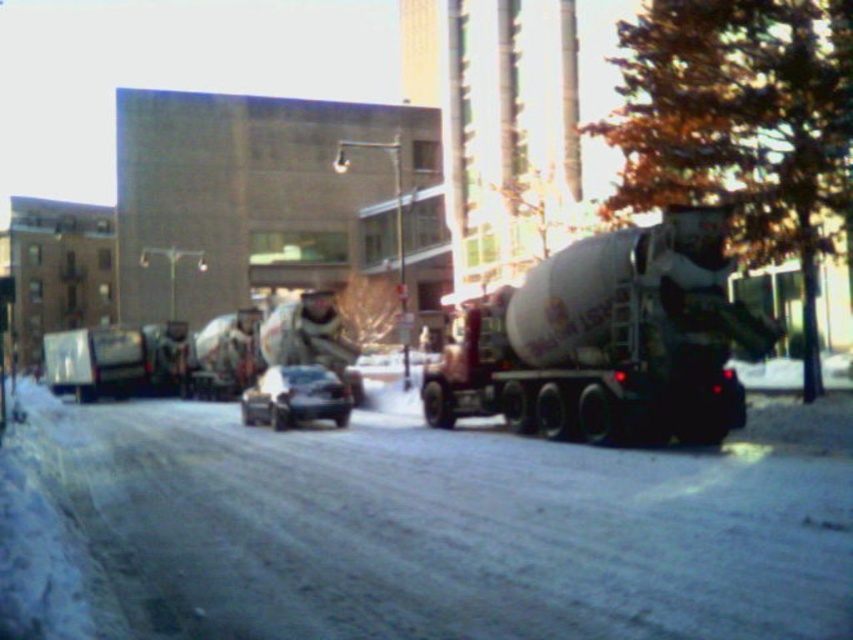
Is white matte cement truck at right to the left of shiny black sedan at center from the viewer's perspective?

No, white matte cement truck at right is not to the left of shiny black sedan at center.

Between point (637, 280) and point (250, 420), which one is positioned behind?

The point (250, 420) is more distant.

Who is more distant from viewer, (664,403) or (346,392)?

The point (346,392) is behind.

Identify the location of white matte cement truck at right. (607, 340).

Is point (202, 572) in front of point (614, 416)?

Yes, it is.

Image resolution: width=853 pixels, height=640 pixels. Identify the location of smooth concrete mixer at center. (405, 532).

This screenshot has width=853, height=640. I want to click on smooth concrete mixer at center, so (x=405, y=532).

Who is lower down, smooth concrete mixer at center or shiny black sedan at center?

smooth concrete mixer at center is below.

The width and height of the screenshot is (853, 640). What do you see at coordinates (405, 532) in the screenshot?
I see `smooth concrete mixer at center` at bounding box center [405, 532].

Identify the location of smooth concrete mixer at center. The image size is (853, 640). (405, 532).